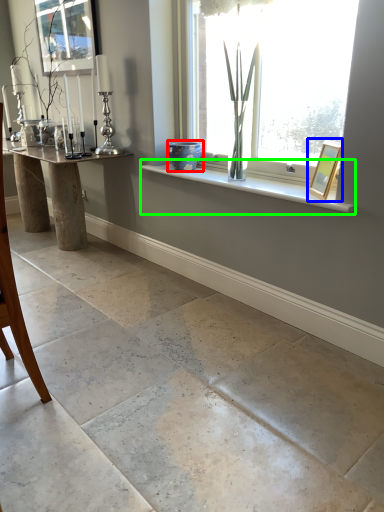
Question: Which is nearer to the glass vase (highlighted by a red box)? picture frame (highlighted by a blue box) or window sill (highlighted by a green box).

Choices:
 (A) picture frame
 (B) window sill

Answer: (B)